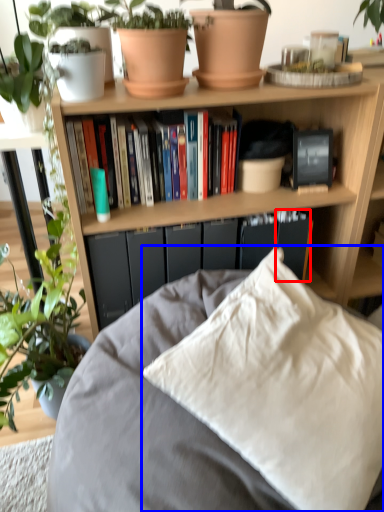
Question: Among these objects, which one is farthest to the camera, paperback book (highlighted by a red box) or pillow (highlighted by a blue box)?

Choices:
 (A) paperback book
 (B) pillow

Answer: (A)